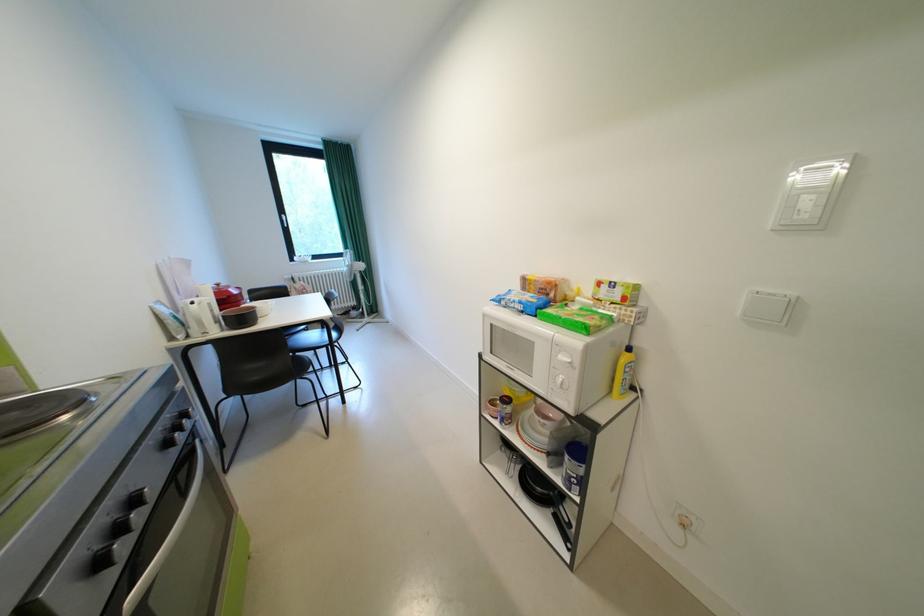
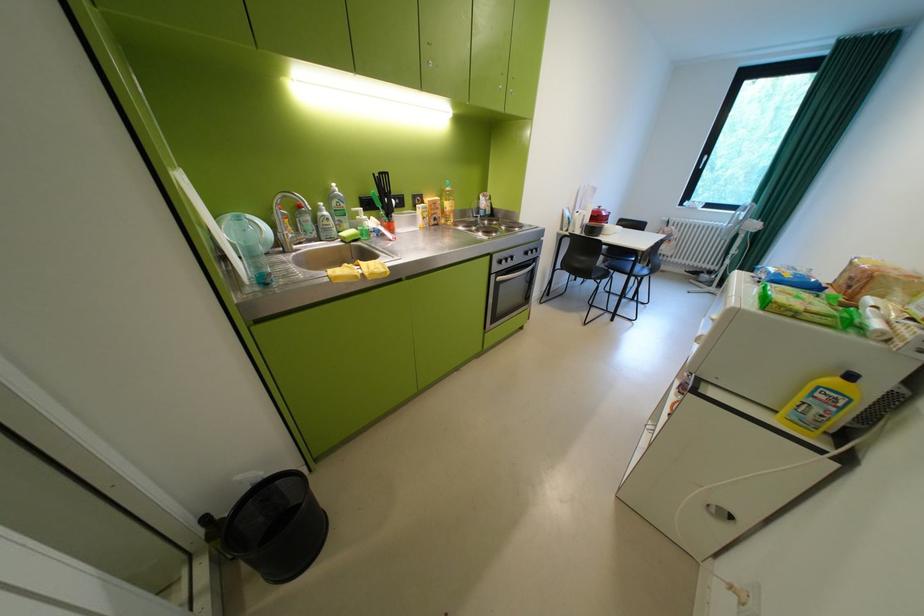
Find the pixel in the second image that matches point 225,294 in the first image.

(603, 213)